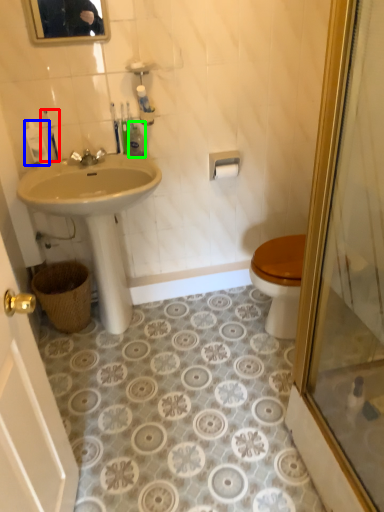
Question: Which object is positioned closest to toiletry (highlighted by a red box)? Select from toiletry (highlighted by a blue box) and toiletry (highlighted by a green box).

Choices:
 (A) toiletry
 (B) toiletry

Answer: (A)